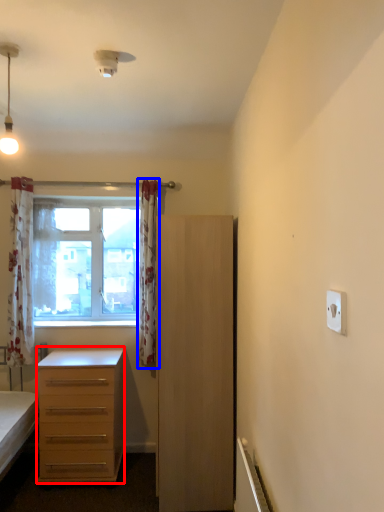
Question: Which object appears closest to the camera in this image, desk (highlighted by a red box) or curtain (highlighted by a blue box)?

Choices:
 (A) desk
 (B) curtain

Answer: (A)